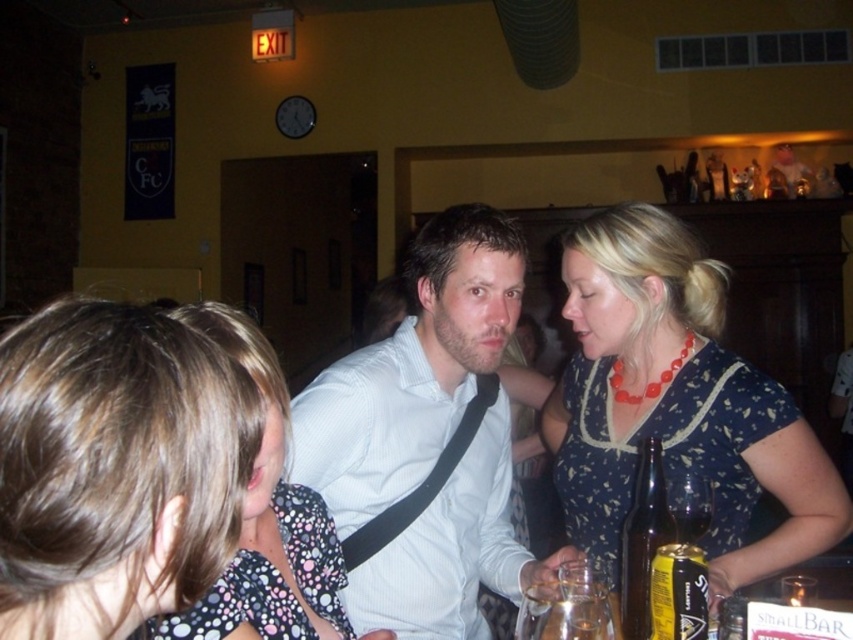
You are a bartender at the bar and need to place a new brown glass bottle at lower right next to the white textured shirt at center. Will the bottle fit next to the shirt without overlapping?

The white textured shirt at center is wider than the brown glass bottle at lower right, so there should be enough space to place the bottle next to the shirt without overlapping.

You are a photographer at the event and need to capture both the polka dot fabric dress at center and the blue dotted dress at center in the same frame. Which dress requires more space in the frame to accommodate its width?

The blue dotted dress at center requires more space in the frame because its width is greater than the polka dot fabric dress at center.

You are a bartender at the bar. You need to place a new brown glass bottle at lower right behind the counter. However, there is already a white textured shirt at center on the counter. Can you fit the new bottle next to the shirt without moving the shirt?

The white textured shirt at center is taller than brown glass bottle at lower right, so it might block space vertically. However, since the bottle is shorter, you could possibly place it next to the shirt horizontally if there is enough horizontal space not occupied by the shirt.